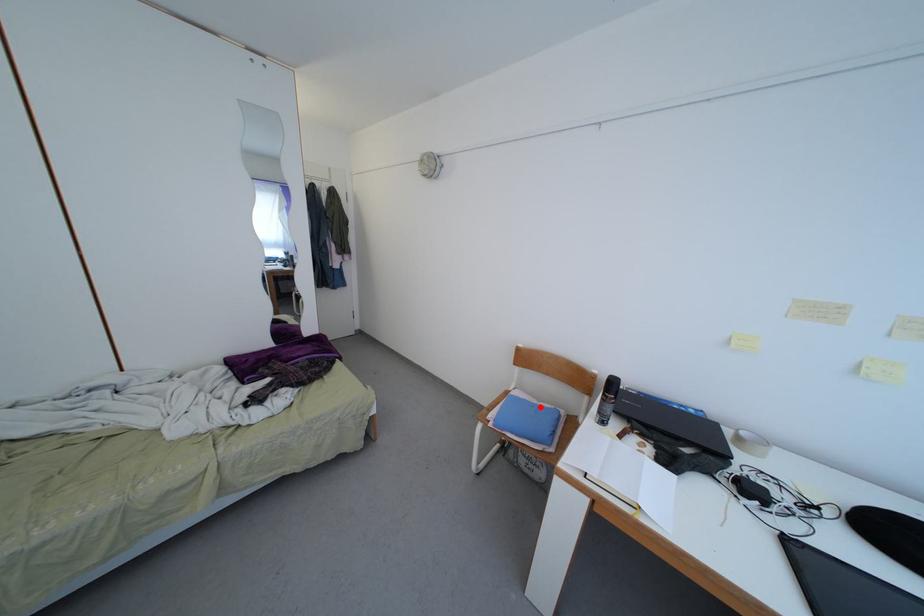
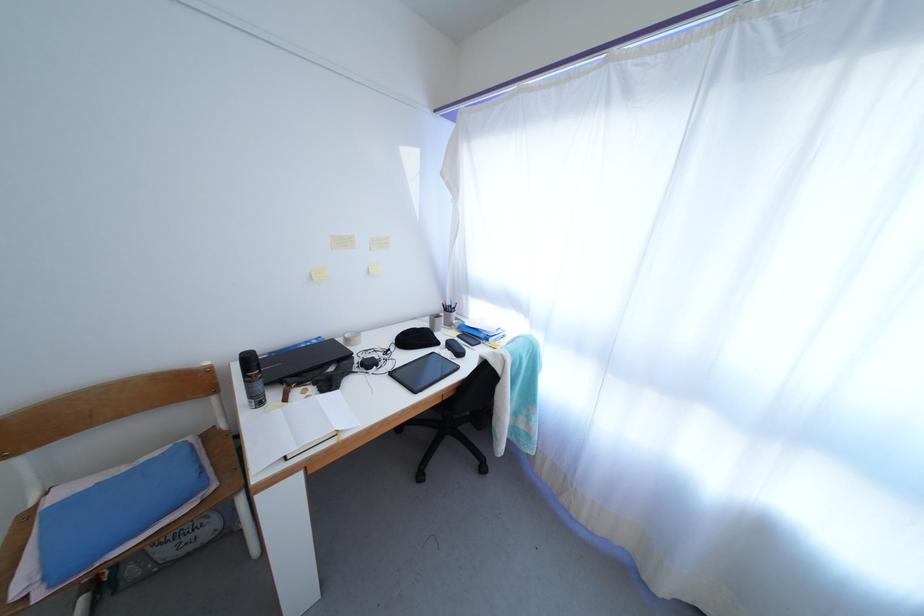
Question: I am providing you with two images of the same scene from different viewpoints. A red point is shown in image1. For the corresponding object point in image2, is it positioned nearer or farther from the camera?

Choices:
 (A) Nearer
 (B) Farther

Answer: (A)